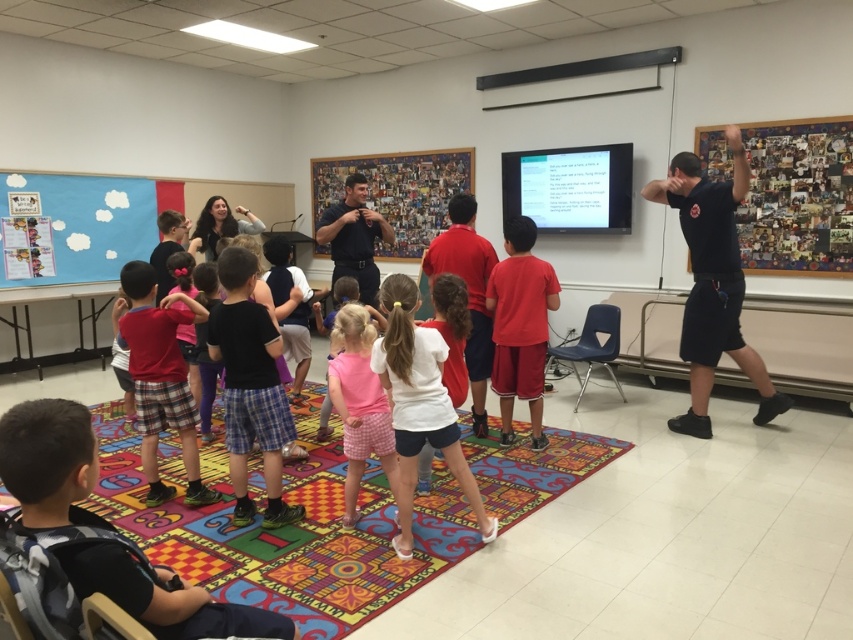
Can you confirm if white matte shirt at center is positioned to the right of plaid shorts at center?

Indeed, white matte shirt at center is positioned on the right side of plaid shorts at center.

Describe the element at coordinates (419, 404) in the screenshot. I see `white matte shirt at center` at that location.

Where is `white matte shirt at center`? Image resolution: width=853 pixels, height=640 pixels. white matte shirt at center is located at coordinates (419, 404).

Is point (175, 198) more distant than point (341, 198)?

Yes, point (175, 198) is farther from viewer.

Is matte blue bulletin board at upper left shorter than black uniform at center?

No, matte blue bulletin board at upper left is not shorter than black uniform at center.

This screenshot has height=640, width=853. What do you see at coordinates (79, 225) in the screenshot?
I see `matte blue bulletin board at upper left` at bounding box center [79, 225].

You are a GUI agent. You are given a task and a screenshot of the screen. Output one action in this format:
    pyautogui.click(x=<x>, y=<y>)
    Task: Click on the matte blue bulletin board at upper left
    
    Given the screenshot: What is the action you would take?
    pyautogui.click(x=79, y=225)

Does black uniform at upper right appear over wooden collage at center?

Incorrect, black uniform at upper right is not positioned above wooden collage at center.

From the picture: Does black uniform at upper right appear under wooden collage at center?

Correct, black uniform at upper right is located below wooden collage at center.

Where is `black uniform at upper right`? Image resolution: width=853 pixels, height=640 pixels. black uniform at upper right is located at coordinates (712, 282).